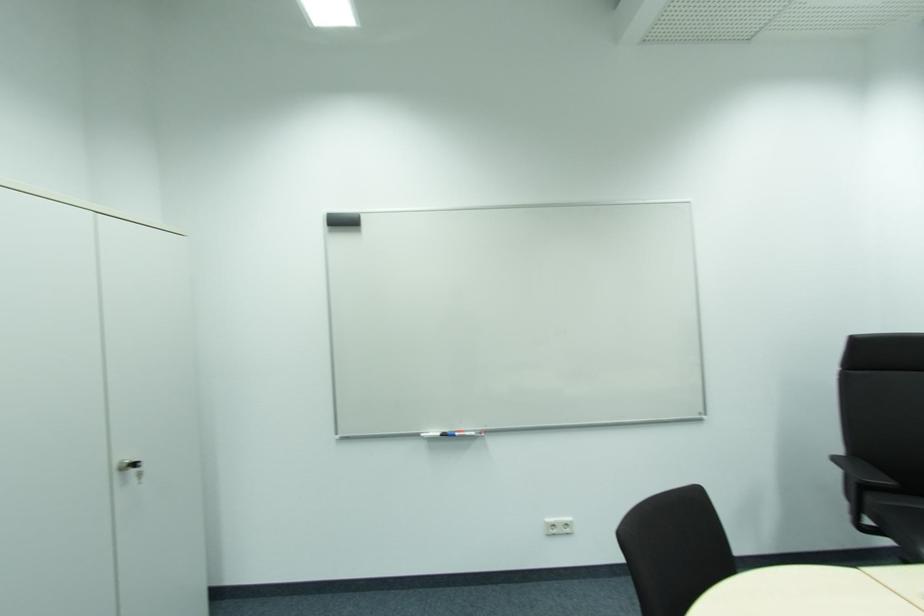
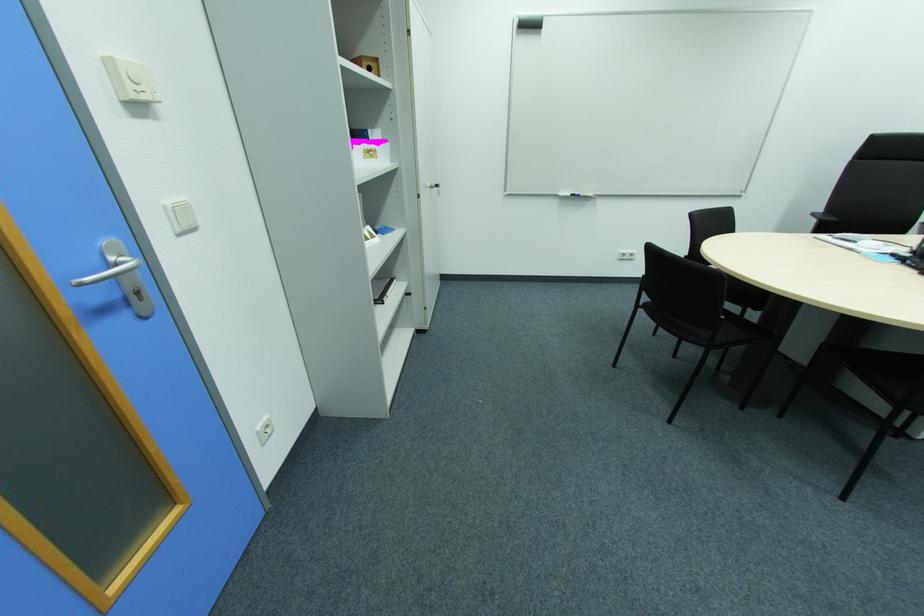
The point at (464, 434) is marked in the first image. Where is the corresponding point in the second image?

(588, 195)